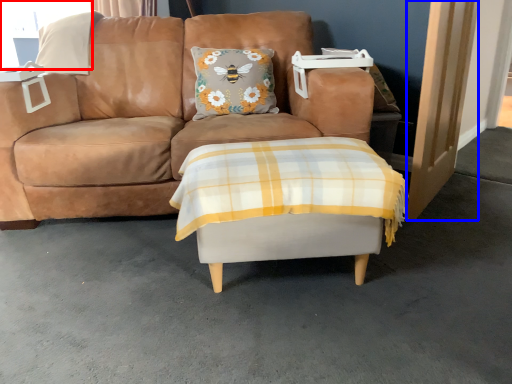
Question: Among these objects, which one is nearest to the camera, window screen (highlighted by a red box) or door (highlighted by a blue box)?

Choices:
 (A) window screen
 (B) door

Answer: (B)